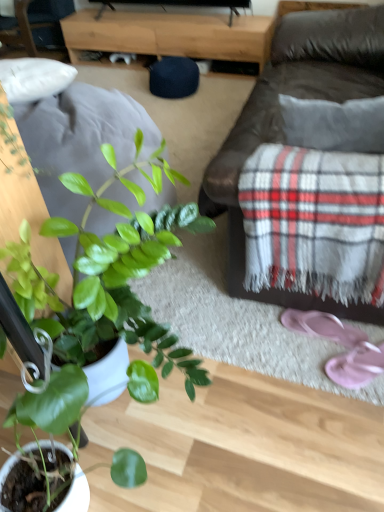
The height and width of the screenshot is (512, 384). What do you see at coordinates (170, 35) in the screenshot?
I see `wooden tv stand at center` at bounding box center [170, 35].

At what (x,y) coordinates should I click in order to perform the action: click on pink fabric flip-flops at lower right, the 2th footwear positioned from the front. Please return your answer as a coordinate pair (x, y). This screenshot has height=512, width=384. Looking at the image, I should click on (325, 327).

From the image's perspective, is pink fabric flip-flops at lower right, the 2th footwear positioned from the front, located above or below wooden tv stand at center?

pink fabric flip-flops at lower right, the 2th footwear positioned from the front, is situated lower than wooden tv stand at center in the image.

Based on the photo, does pink fabric flip-flops at lower right, the 2th footwear positioned from the front, touch wooden tv stand at center?

They are not placed beside each other.

How many degrees apart are the facing directions of pink fabric flip-flops at lower right, the 2th footwear positioned from the front, and wooden tv stand at center?

91.6 degrees.

From a real-world perspective, is pink fabric flip-flops at lower right, the 1th footwear viewed from the back, beneath wooden tv stand at center?

Indeed, from a real-world perspective, pink fabric flip-flops at lower right, the 1th footwear viewed from the back, is positioned beneath wooden tv stand at center.

Which is more to the left, green matte plant at lower left or wooden tv stand at center?

Positioned to the left is green matte plant at lower left.

Is the depth of green matte plant at lower left less than that of wooden tv stand at center?

Yes, green matte plant at lower left is in front of wooden tv stand at center.

From the image's perspective, which one is positioned higher, green matte plant at lower left or wooden tv stand at center?

wooden tv stand at center appears higher in the image.

Between point (74, 354) and point (231, 26), which one is positioned behind?

The point (231, 26) is farther from the camera.

Considering the positions of objects green matte plant at lower left and pink fabric flip-flops at lower right, marked as the 1th footwear in a front-to-back arrangement, in the image provided, who is more to the left, green matte plant at lower left or pink fabric flip-flops at lower right, marked as the 1th footwear in a front-to-back arrangement,?

green matte plant at lower left.

From a real-world perspective, which object rests below the other?

pink fabric flip-flops at lower right, marked as the 1th footwear in a front-to-back arrangement, is physically lower.

Are green matte plant at lower left and pink fabric flip-flops at lower right, marked as the 1th footwear in a front-to-back arrangement, making contact?

green matte plant at lower left and pink fabric flip-flops at lower right, marked as the 1th footwear in a front-to-back arrangement, are not in contact.

Which point is more distant from viewer, (x=42, y=390) or (x=339, y=338)?

Point (x=339, y=338)

Which is more to the left, green matte plant at lower left or pink fabric flip-flops at lower right, the 2th footwear positioned from the front?

Positioned to the left is green matte plant at lower left.

Which of these two, green matte plant at lower left or pink fabric flip-flops at lower right, the 1th footwear viewed from the back, stands shorter?

pink fabric flip-flops at lower right, the 1th footwear viewed from the back, is shorter.

Are green matte plant at lower left and pink fabric flip-flops at lower right, the 1th footwear viewed from the back, beside each other?

No, green matte plant at lower left is not beside pink fabric flip-flops at lower right, the 1th footwear viewed from the back.

What's the angular difference between green matte plant at lower left and pink fabric flip-flops at lower right, the 2th footwear positioned from the front,'s facing directions?

88.6 degrees.

Looking at the image, does brown leather couch at center seem bigger or smaller compared to pink fabric flip-flops at lower right, marked as the 1th footwear in a front-to-back arrangement?

Considering their sizes, brown leather couch at center takes up more space than pink fabric flip-flops at lower right, marked as the 1th footwear in a front-to-back arrangement.

Considering the positions of objects brown leather couch at center and pink fabric flip-flops at lower right, the 2th footwear from the back, in the image provided, who is more to the right, brown leather couch at center or pink fabric flip-flops at lower right, the 2th footwear from the back,?

Positioned to the right is pink fabric flip-flops at lower right, the 2th footwear from the back.

Is pink fabric flip-flops at lower right, the 2th footwear from the back, inside brown leather couch at center?

No, pink fabric flip-flops at lower right, the 2th footwear from the back, is located outside of brown leather couch at center.

Does pink fabric flip-flops at lower right, marked as the 1th footwear in a front-to-back arrangement, have a greater height compared to green matte plant at lower left?

No.

Is pink fabric flip-flops at lower right, the 2th footwear from the back, not close to green matte plant at lower left?

No, pink fabric flip-flops at lower right, the 2th footwear from the back, is not far away from green matte plant at lower left.

Can you confirm if pink fabric flip-flops at lower right, the 2th footwear from the back, is bigger than green matte plant at lower left?

No.

Consider the image. Is pink fabric flip-flops at lower right, the 1th footwear viewed from the back, placed right next to green matte plant at lower left?

No, pink fabric flip-flops at lower right, the 1th footwear viewed from the back, is not beside green matte plant at lower left.

From a real-world perspective, which footwear is the 1st one underneath the green matte plant at lower left? Please provide its 2D coordinates.

[(325, 327)]

From the picture: Considering their positions, is pink fabric flip-flops at lower right, the 2th footwear positioned from the front, located in front of or behind green matte plant at lower left?

Visually, pink fabric flip-flops at lower right, the 2th footwear positioned from the front, is located behind green matte plant at lower left.

Considering the relative sizes of pink fabric flip-flops at lower right, the 1th footwear viewed from the back, and green matte plant at lower left in the image provided, is pink fabric flip-flops at lower right, the 1th footwear viewed from the back, taller than green matte plant at lower left?

No.

From a real-world perspective, starting from the wooden tv stand at center, which footwear is the 1st one below it? Please provide its 2D coordinates.

[(325, 327)]

Find the location of a particular element. This screenshot has width=384, height=512. houseplant that is above the wooden tv stand at center (from a real-world perspective) is located at coordinates (92, 318).

Which object lies further to the anchor point pink fabric flip-flops at lower right, the 2th footwear from the back, wooden tv stand at center or green matte plant at lower left?

The object further to pink fabric flip-flops at lower right, the 2th footwear from the back, is wooden tv stand at center.

In the scene shown: When comparing their distances from green matte plant at lower left, does pink fabric flip-flops at lower right, the 2th footwear from the back, or wooden tv stand at center seem closer?

The object closer to green matte plant at lower left is pink fabric flip-flops at lower right, the 2th footwear from the back.

Estimate the real-world distances between objects in this image. Which object is further from green matte plant at lower left, brown leather couch at center or pink fabric flip-flops at lower right, the 2th footwear positioned from the front?

Among the two, brown leather couch at center is located further to green matte plant at lower left.

From the picture: Considering their positions, is pink fabric flip-flops at lower right, the 2th footwear positioned from the front, positioned further to brown leather couch at center than green matte plant at lower left?

Based on the image, pink fabric flip-flops at lower right, the 2th footwear positioned from the front, appears to be further to brown leather couch at center.

Which object lies nearer to the anchor point brown leather couch at center, green matte plant at lower left or wooden tv stand at center?

The object closer to brown leather couch at center is green matte plant at lower left.

Based on their spatial positions, is wooden tv stand at center or pink fabric flip-flops at lower right, the 2th footwear from the back, closer to pink fabric flip-flops at lower right, the 1th footwear viewed from the back?

pink fabric flip-flops at lower right, the 2th footwear from the back, is positioned closer to the anchor pink fabric flip-flops at lower right, the 1th footwear viewed from the back.

From the image, which object appears to be farther from pink fabric flip-flops at lower right, the 1th footwear viewed from the back, green matte plant at lower left or wooden tv stand at center?

wooden tv stand at center.

Which object lies further to the anchor point pink fabric flip-flops at lower right, marked as the 1th footwear in a front-to-back arrangement, pink fabric flip-flops at lower right, the 2th footwear positioned from the front, or wooden tv stand at center?

wooden tv stand at center lies further to pink fabric flip-flops at lower right, marked as the 1th footwear in a front-to-back arrangement, than the other object.

I want to click on footwear between green matte plant at lower left and pink fabric flip-flops at lower right, the 2th footwear positioned from the front, along the z-axis, so coord(342,344).

Locate an element on the screen. studio couch positioned between green matte plant at lower left and wooden tv stand at center from near to far is located at coordinates (283, 122).

Locate an element on the screen. The width and height of the screenshot is (384, 512). footwear between brown leather couch at center and pink fabric flip-flops at lower right, marked as the 1th footwear in a front-to-back arrangement, from top to bottom is located at coordinates (325, 327).

Where is `houseplant between brown leather couch at center and pink fabric flip-flops at lower right, the 1th footwear viewed from the back, in the up-down direction`? Image resolution: width=384 pixels, height=512 pixels. houseplant between brown leather couch at center and pink fabric flip-flops at lower right, the 1th footwear viewed from the back, in the up-down direction is located at coordinates (92, 318).